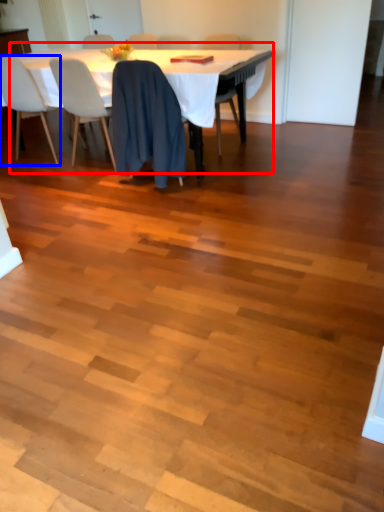
Question: Which object appears farthest to the camera in this image, table (highlighted by a red box) or chair (highlighted by a blue box)?

Choices:
 (A) table
 (B) chair

Answer: (B)